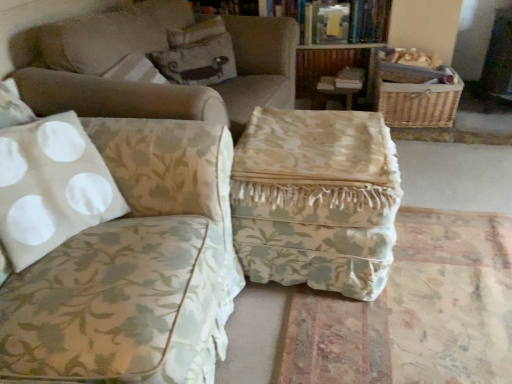
Question: Which direction should I rotate to look at floral fabric ottoman at center, which is the first studio couch from back to front?

Choices:
 (A) right
 (B) left

Answer: (B)

Question: Is woven brown basket at upper right thinner than floral fabric ottoman at center, which is the first studio couch from back to front?

Choices:
 (A) yes
 (B) no

Answer: (A)

Question: Is woven brown basket at upper right to the left of floral fabric ottoman at center, which is the first studio couch from back to front, from the viewer's perspective?

Choices:
 (A) no
 (B) yes

Answer: (A)

Question: Are woven brown basket at upper right and floral fabric ottoman at center, which is the first studio couch from back to front, beside each other?

Choices:
 (A) yes
 (B) no

Answer: (B)

Question: Does woven brown basket at upper right have a greater width compared to floral fabric ottoman at center, which is the first studio couch from back to front?

Choices:
 (A) no
 (B) yes

Answer: (A)

Question: Is woven brown basket at upper right closer to the viewer compared to floral fabric ottoman at center, which is counted as the second studio couch, starting from the front?

Choices:
 (A) no
 (B) yes

Answer: (A)

Question: From the image's perspective, is woven brown basket at upper right over floral fabric ottoman at center, which is counted as the second studio couch, starting from the front?

Choices:
 (A) no
 (B) yes

Answer: (B)

Question: From the image's perspective, does white fabric studio couch at left, the second studio couch viewed from the back, appear higher than woven brown basket at upper right?

Choices:
 (A) no
 (B) yes

Answer: (A)

Question: Is white fabric studio couch at left, the second studio couch viewed from the back, bigger than woven brown basket at upper right?

Choices:
 (A) no
 (B) yes

Answer: (B)

Question: Is the depth of white fabric studio couch at left, which appears as the 1th studio couch when viewed from the front, less than that of woven brown basket at upper right?

Choices:
 (A) yes
 (B) no

Answer: (A)

Question: From a real-world perspective, is white fabric studio couch at left, which appears as the 1th studio couch when viewed from the front, positioned over woven brown basket at upper right based on gravity?

Choices:
 (A) no
 (B) yes

Answer: (B)

Question: Is white fabric studio couch at left, which appears as the 1th studio couch when viewed from the front, placed right next to woven brown basket at upper right?

Choices:
 (A) no
 (B) yes

Answer: (A)

Question: Is white fabric studio couch at left, which appears as the 1th studio couch when viewed from the front, thinner than woven brown basket at upper right?

Choices:
 (A) no
 (B) yes

Answer: (A)

Question: From the image's perspective, is floral fabric ottoman at center, which is counted as the second studio couch, starting from the front, on floral fabric ottoman at center?

Choices:
 (A) no
 (B) yes

Answer: (B)